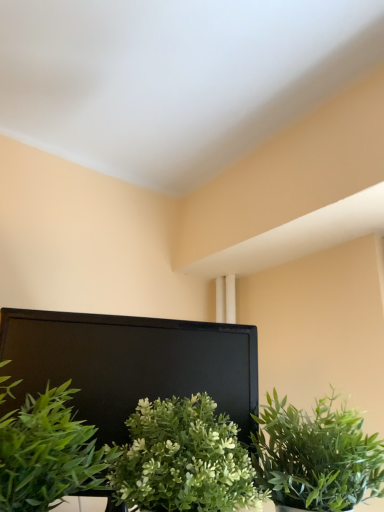
Question: Is green leafy plant at center, which is the 3th houseplant from left to right, next to green leafy plant at lower left, the 1th houseplant positioned from the left, and touching it?

Choices:
 (A) no
 (B) yes

Answer: (A)

Question: Can you confirm if green leafy plant at center, which is the 3th houseplant from left to right, is thinner than green leafy plant at lower left, the 3th houseplant viewed from the right?

Choices:
 (A) yes
 (B) no

Answer: (B)

Question: From the image's perspective, is green leafy plant at center, the 1th houseplant when ordered from right to left, over green leafy plant at lower left, the 1th houseplant positioned from the left?

Choices:
 (A) yes
 (B) no

Answer: (B)

Question: Does green leafy plant at center, the 1th houseplant when ordered from right to left, turn towards green leafy plant at lower left, the 1th houseplant positioned from the left?

Choices:
 (A) no
 (B) yes

Answer: (A)

Question: Considering the relative sizes of green leafy plant at center, the 1th houseplant when ordered from right to left, and green leafy plant at lower left, the 3th houseplant viewed from the right, in the image provided, is green leafy plant at center, the 1th houseplant when ordered from right to left, shorter than green leafy plant at lower left, the 3th houseplant viewed from the right,?

Choices:
 (A) no
 (B) yes

Answer: (B)

Question: Considering the relative positions of green leafy plant at center, the 1th houseplant when ordered from right to left, and green leafy plant at lower left, the 1th houseplant positioned from the left, in the image provided, is green leafy plant at center, the 1th houseplant when ordered from right to left, to the left of green leafy plant at lower left, the 1th houseplant positioned from the left, from the viewer's perspective?

Choices:
 (A) yes
 (B) no

Answer: (B)

Question: Considering the relative sizes of green leafy plant at center, which is the 3th houseplant from left to right, and green matte plant at center, the second houseplant in the left-to-right sequence, in the image provided, is green leafy plant at center, which is the 3th houseplant from left to right, shorter than green matte plant at center, the second houseplant in the left-to-right sequence,?

Choices:
 (A) no
 (B) yes

Answer: (B)

Question: Considering the relative sizes of green leafy plant at center, the 1th houseplant when ordered from right to left, and green matte plant at center, the second houseplant viewed from the right, in the image provided, is green leafy plant at center, the 1th houseplant when ordered from right to left, smaller than green matte plant at center, the second houseplant viewed from the right,?

Choices:
 (A) no
 (B) yes

Answer: (A)

Question: Is green leafy plant at center, which is the 3th houseplant from left to right, closer to camera compared to green matte plant at center, the second houseplant viewed from the right?

Choices:
 (A) yes
 (B) no

Answer: (B)

Question: Is green leafy plant at center, which is the 3th houseplant from left to right, behind green matte plant at center, the second houseplant in the left-to-right sequence?

Choices:
 (A) yes
 (B) no

Answer: (A)

Question: Could you tell me if green leafy plant at center, the 1th houseplant when ordered from right to left, is facing green matte plant at center, the second houseplant in the left-to-right sequence?

Choices:
 (A) no
 (B) yes

Answer: (A)

Question: From a real-world perspective, is green leafy plant at center, which is the 3th houseplant from left to right, beneath green matte plant at center, the second houseplant viewed from the right?

Choices:
 (A) no
 (B) yes

Answer: (A)

Question: From a real-world perspective, is green matte plant at center, the second houseplant in the left-to-right sequence, on top of green leafy plant at center, which is the 3th houseplant from left to right?

Choices:
 (A) no
 (B) yes

Answer: (A)